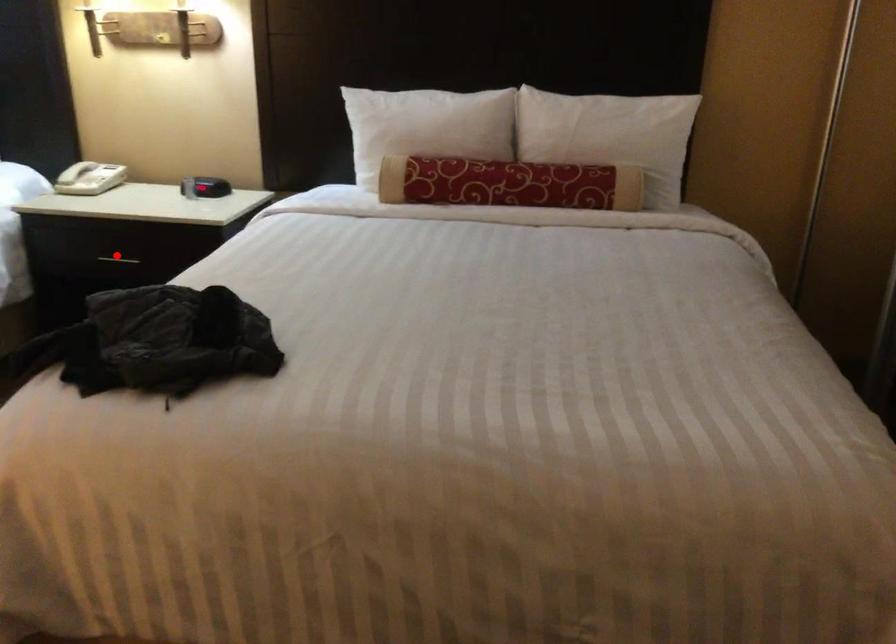
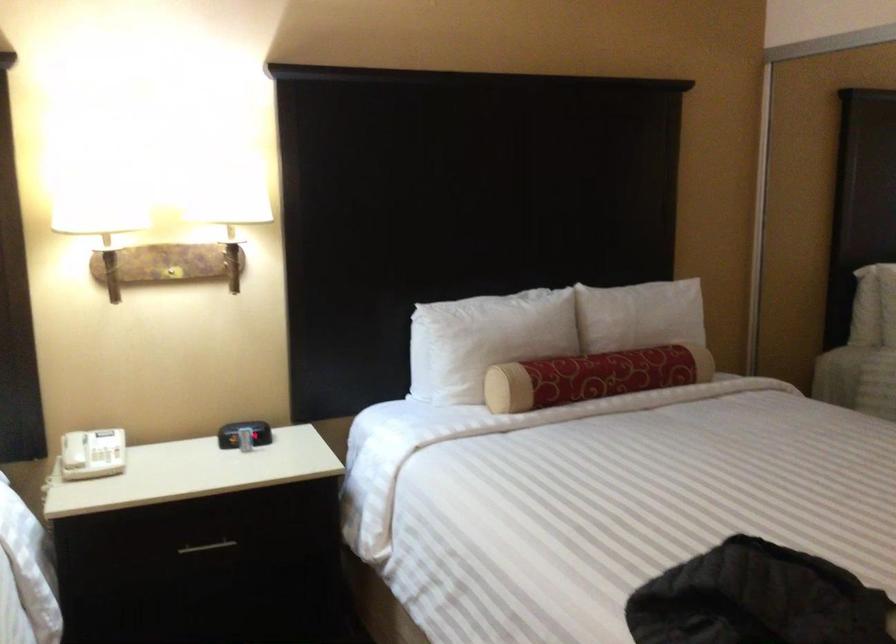
Question: A red point is marked in image1. In image2, is the corresponding 3D point closer to the camera or farther? Reply with the corresponding letter.

Choices:
 (A) The corresponding 3D point is closer.
 (B) The corresponding 3D point is farther.

Answer: (A)